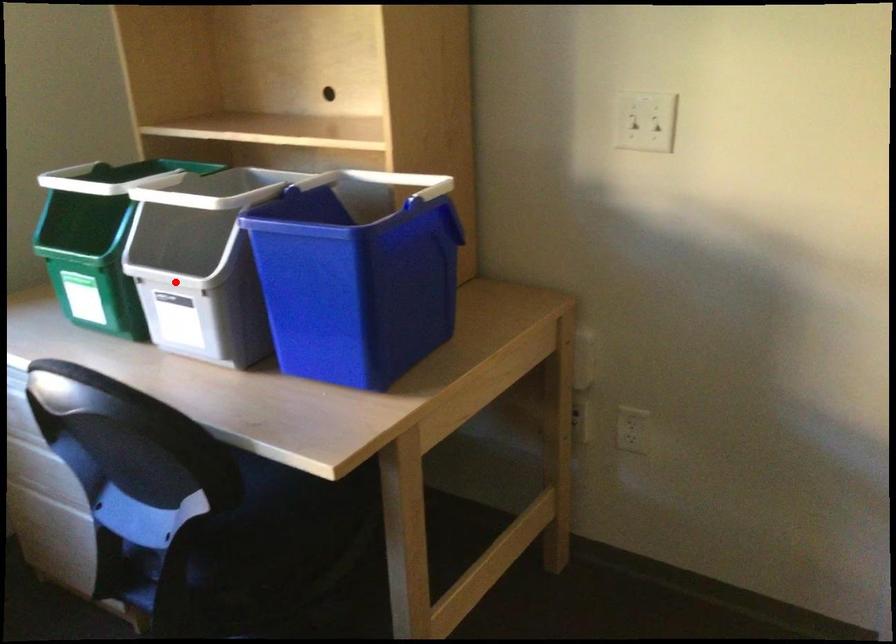
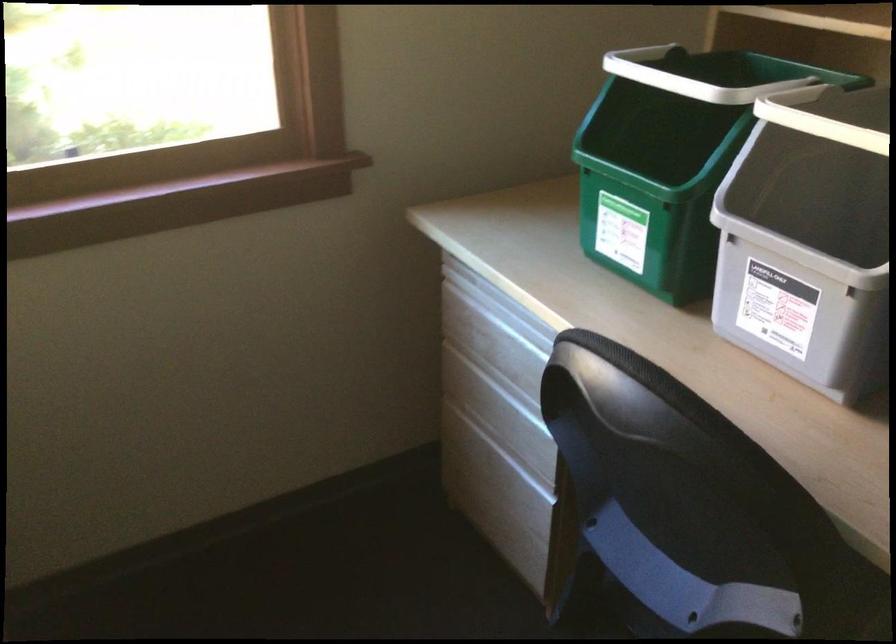
Where in the second image is the point corresponding to the highlighted location from the first image?

(797, 250)